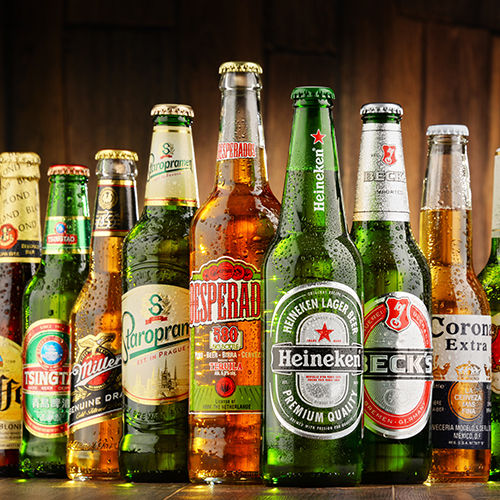
The image size is (500, 500). What are the coordinates of `green bottle` in the screenshot? It's located at (48, 281), (153, 244), (311, 251), (392, 252), (488, 277).